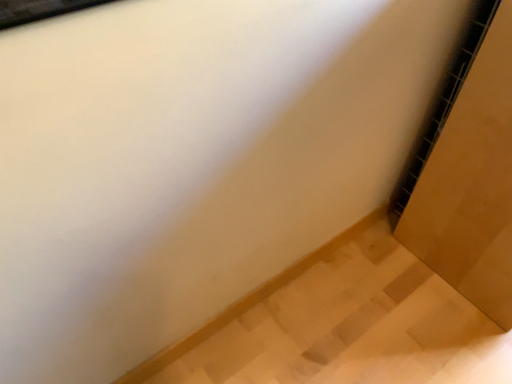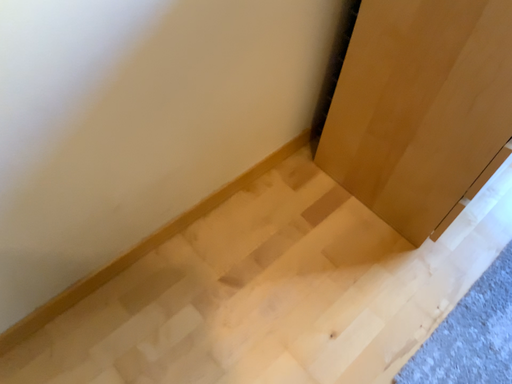
Question: How did the camera likely rotate when shooting the video?

Choices:
 (A) rotated upward
 (B) rotated downward

Answer: (B)